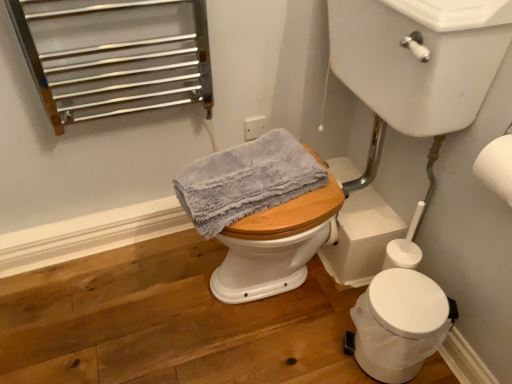
Question: Is the position of white glossy sink at upper right less distant than that of white matte toilet paper at upper right?

Choices:
 (A) yes
 (B) no

Answer: (A)

Question: Could you tell me if white glossy sink at upper right is turned towards white matte toilet paper at upper right?

Choices:
 (A) yes
 (B) no

Answer: (B)

Question: Is white glossy sink at upper right facing away from white matte toilet paper at upper right?

Choices:
 (A) no
 (B) yes

Answer: (A)

Question: Can white matte toilet paper at upper right be found inside white glossy sink at upper right?

Choices:
 (A) yes
 (B) no

Answer: (B)

Question: Is white glossy sink at upper right taller than white matte toilet paper at upper right?

Choices:
 (A) yes
 (B) no

Answer: (A)

Question: From a real-world perspective, is white glossy sink at upper right under white matte toilet paper at upper right?

Choices:
 (A) yes
 (B) no

Answer: (A)

Question: Considering the relative sizes of white glossy sink at upper right and white plastic trash can at lower right in the image provided, is white glossy sink at upper right taller than white plastic trash can at lower right?

Choices:
 (A) no
 (B) yes

Answer: (B)

Question: Considering the relative sizes of white glossy sink at upper right and white plastic trash can at lower right in the image provided, is white glossy sink at upper right shorter than white plastic trash can at lower right?

Choices:
 (A) no
 (B) yes

Answer: (A)

Question: Is white glossy sink at upper right at the left side of white plastic trash can at lower right?

Choices:
 (A) no
 (B) yes

Answer: (B)

Question: Could you tell me if white glossy sink at upper right is turned towards white plastic trash can at lower right?

Choices:
 (A) no
 (B) yes

Answer: (A)

Question: Does white glossy sink at upper right lie in front of white plastic trash can at lower right?

Choices:
 (A) no
 (B) yes

Answer: (B)

Question: From a real-world perspective, is white glossy sink at upper right located beneath white plastic trash can at lower right?

Choices:
 (A) no
 (B) yes

Answer: (A)

Question: Is white glossy sink at upper right next to gray textured towel at center and touching it?

Choices:
 (A) yes
 (B) no

Answer: (B)